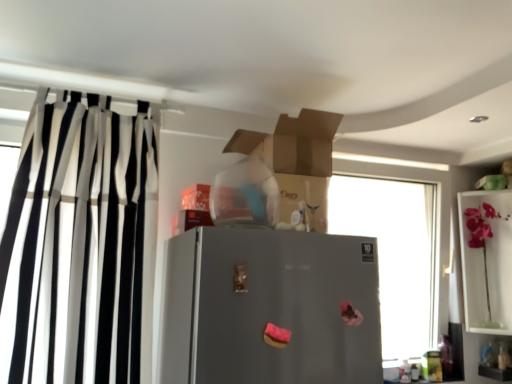
Measure the distance between gray matte refrigerator at center and camera.

They are 3.66 feet apart.

The width and height of the screenshot is (512, 384). I want to click on pink glass vase at upper right, so click(x=487, y=260).

Is transparent glass window at center shorter than black and white striped curtain at left?

Correct, transparent glass window at center is not as tall as black and white striped curtain at left.

Considering the relative sizes of transparent glass window at center and black and white striped curtain at left in the image provided, is transparent glass window at center thinner than black and white striped curtain at left?

Indeed, transparent glass window at center has a lesser width compared to black and white striped curtain at left.

Based on their positions, is transparent glass window at center located to the left or right of black and white striped curtain at left?

In the image, transparent glass window at center appears on the right side of black and white striped curtain at left.

From the image's perspective, is transparent glass window at center positioned above or below black and white striped curtain at left?

transparent glass window at center is situated lower than black and white striped curtain at left in the image.

Does gray matte refrigerator at center have a smaller size compared to black and white striped curtain at left?

Yes, gray matte refrigerator at center is smaller than black and white striped curtain at left.

Is the position of gray matte refrigerator at center less distant than that of black and white striped curtain at left?

Yes, gray matte refrigerator at center is in front of black and white striped curtain at left.

What's the angular difference between gray matte refrigerator at center and black and white striped curtain at left's facing directions?

The facing directions of gray matte refrigerator at center and black and white striped curtain at left are 0.809 degrees apart.

Considering the relative positions of gray matte refrigerator at center and black and white striped curtain at left in the image provided, is gray matte refrigerator at center to the left of black and white striped curtain at left from the viewer's perspective?

Incorrect, gray matte refrigerator at center is not on the left side of black and white striped curtain at left.

In the scene shown: Is black and white striped curtain at left positioned with its back to transparent glass window at center?

No, transparent glass window at center is not at the back of black and white striped curtain at left.

Can you confirm if black and white striped curtain at left is thinner than transparent glass window at center?

No.

Consider the image. Based on their positions, is black and white striped curtain at left located to the left or right of transparent glass window at center?

In the image, black and white striped curtain at left appears on the left side of transparent glass window at center.

Is black and white striped curtain at left not close to transparent glass window at center?

Yes, black and white striped curtain at left and transparent glass window at center are quite far apart.

From the image's perspective, which is below, gray matte refrigerator at center or transparent glass window at center?

transparent glass window at center is shown below in the image.

Considering the positions of points (183, 347) and (412, 186), is point (183, 347) closer to camera compared to point (412, 186)?

Yes, point (183, 347) is in front of point (412, 186).

Is gray matte refrigerator at center surrounding transparent glass window at center?

Definitely not — transparent glass window at center is not inside gray matte refrigerator at center.

Consider the image. Looking at the image, does gray matte refrigerator at center seem bigger or smaller compared to transparent glass window at center?

In the image, gray matte refrigerator at center appears to be smaller than transparent glass window at center.

From the picture: Is pink glass vase at upper right thinner than black and white striped curtain at left?

In fact, pink glass vase at upper right might be wider than black and white striped curtain at left.

Are pink glass vase at upper right and black and white striped curtain at left beside each other?

No, pink glass vase at upper right is not beside black and white striped curtain at left.

Is pink glass vase at upper right taller than black and white striped curtain at left?

In fact, pink glass vase at upper right may be shorter than black and white striped curtain at left.

From the picture: Which object is more forward, gray matte refrigerator at center or pink glass vase at upper right?

gray matte refrigerator at center is in front.

Considering the sizes of objects gray matte refrigerator at center and pink glass vase at upper right in the image provided, who is thinner, gray matte refrigerator at center or pink glass vase at upper right?

Thinner between the two is gray matte refrigerator at center.

Is gray matte refrigerator at center at the right side of pink glass vase at upper right?

No.

Considering the points (94, 291) and (470, 290), which point is behind, point (94, 291) or point (470, 290)?

The point (470, 290) is farther.

Is black and white striped curtain at left turned away from pink glass vase at upper right?

No, black and white striped curtain at left is not facing away from pink glass vase at upper right.

From the image's perspective, is black and white striped curtain at left under pink glass vase at upper right?

No.

Which object is closer to the camera taking this photo, black and white striped curtain at left or pink glass vase at upper right?

black and white striped curtain at left is closer to the camera.

Where is `curtain above the transparent glass window at center (from the image's perspective)`? The height and width of the screenshot is (384, 512). curtain above the transparent glass window at center (from the image's perspective) is located at coordinates (80, 245).

Identify the location of refrigerator below the black and white striped curtain at left (from the image's perspective). Image resolution: width=512 pixels, height=384 pixels. click(x=269, y=308).

Estimate the real-world distances between objects in this image. Which object is closer to pink glass vase at upper right, gray matte refrigerator at center or black and white striped curtain at left?

Based on the image, gray matte refrigerator at center appears to be nearer to pink glass vase at upper right.

Which object lies further to the anchor point pink glass vase at upper right, transparent glass window at center or gray matte refrigerator at center?

gray matte refrigerator at center lies further to pink glass vase at upper right than the other object.

Based on their spatial positions, is pink glass vase at upper right or gray matte refrigerator at center further from black and white striped curtain at left?

pink glass vase at upper right.

Considering their positions, is black and white striped curtain at left positioned closer to transparent glass window at center than gray matte refrigerator at center?

gray matte refrigerator at center is positioned closer to the anchor transparent glass window at center.

Looking at the image, which one is located closer to black and white striped curtain at left, transparent glass window at center or gray matte refrigerator at center?

Based on the image, gray matte refrigerator at center appears to be nearer to black and white striped curtain at left.

Looking at the image, which one is located further to transparent glass window at center, pink glass vase at upper right or gray matte refrigerator at center?

Among the two, gray matte refrigerator at center is located further to transparent glass window at center.

Considering their positions, is pink glass vase at upper right positioned further to transparent glass window at center than black and white striped curtain at left?

Among the two, black and white striped curtain at left is located further to transparent glass window at center.

Estimate the real-world distances between objects in this image. Which object is further from black and white striped curtain at left, pink glass vase at upper right or transparent glass window at center?

pink glass vase at upper right lies further to black and white striped curtain at left than the other object.

Identify the location of refrigerator between black and white striped curtain at left and transparent glass window at center. Image resolution: width=512 pixels, height=384 pixels. (269, 308).

Identify the location of window between gray matte refrigerator at center and pink glass vase at upper right in the horizontal direction. This screenshot has width=512, height=384. (394, 253).

Locate an element on the screen. This screenshot has height=384, width=512. window situated between black and white striped curtain at left and pink glass vase at upper right from left to right is located at coordinates (394, 253).

Find the location of `refrigerator located between black and white striped curtain at left and pink glass vase at upper right in the left-right direction`. refrigerator located between black and white striped curtain at left and pink glass vase at upper right in the left-right direction is located at coordinates (269, 308).